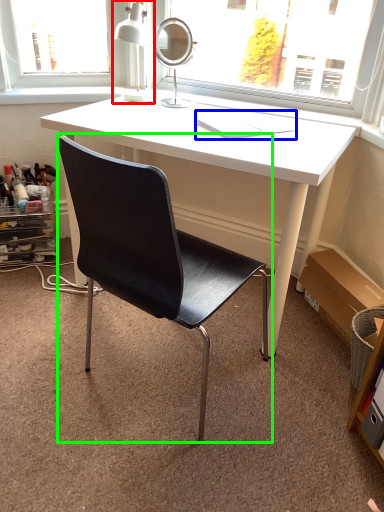
Question: Which object is the farthest from table lamp (highlighted by a red box)? Choose among these: book (highlighted by a blue box) or chair (highlighted by a green box).

Choices:
 (A) book
 (B) chair

Answer: (B)